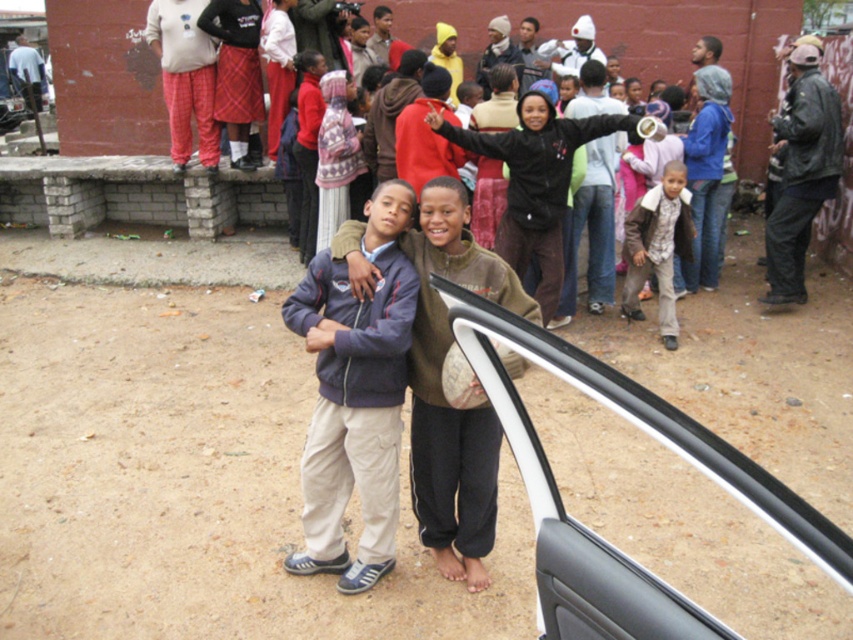
Question: Does brown fuzzy sweater at center have a larger size compared to plaid skirt at upper center?

Choices:
 (A) yes
 (B) no

Answer: (A)

Question: Which is farther from the camouflage jacket at center?

Choices:
 (A) dark blue fleece jacket at center
 (B) brown fuzzy sweater at center
 (C) dark brown leather jacket at center
 (D) plaid skirt at upper center

Answer: (D)

Question: Does dark blue fleece jacket at center have a greater width compared to plaid skirt at upper center?

Choices:
 (A) no
 (B) yes

Answer: (B)

Question: Which of the following is the farthest from the observer?

Choices:
 (A) (683, 196)
 (B) (428, 515)
 (C) (242, 113)

Answer: (C)

Question: Does dark blue fleece jacket at center have a greater width compared to plaid skirt at upper center?

Choices:
 (A) no
 (B) yes

Answer: (B)

Question: Which point appears farthest from the camera in this image?

Choices:
 (A) (479, 248)
 (B) (256, 90)
 (C) (531, 152)

Answer: (B)